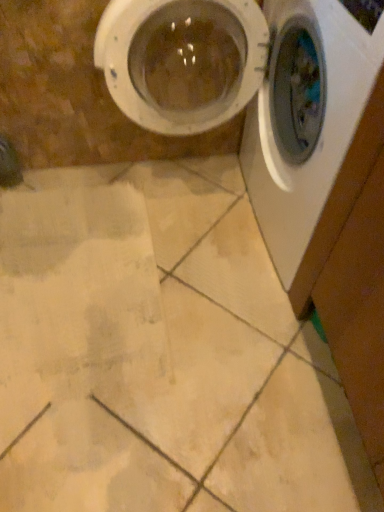
Locate an element on the screen. The height and width of the screenshot is (512, 384). vacant location below white plastic washing machine at upper right, the 2th washing machine when ordered from right to left (from a real-world perspective) is located at coordinates (199, 222).